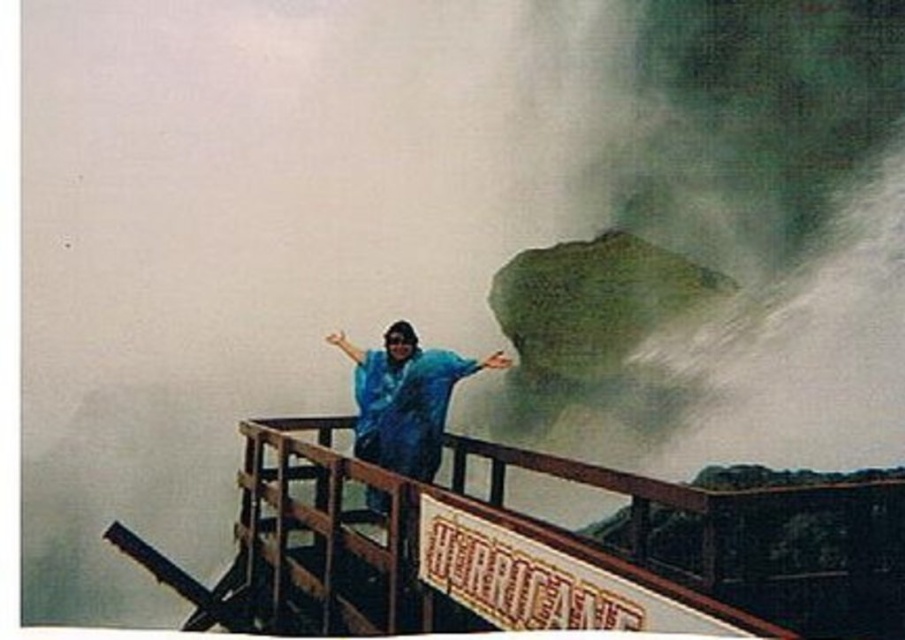
Can you confirm if brown wooden rail at center is positioned to the right of blue waterproof jacket at center?

Incorrect, brown wooden rail at center is not on the right side of blue waterproof jacket at center.

Based on the photo, between brown wooden rail at center and blue waterproof jacket at center, which one is positioned higher?

blue waterproof jacket at center is higher up.

Between point (318, 552) and point (494, 356), which one is positioned in front?

Point (318, 552) is in front.

Where is `brown wooden rail at center`? brown wooden rail at center is located at coordinates (567, 538).